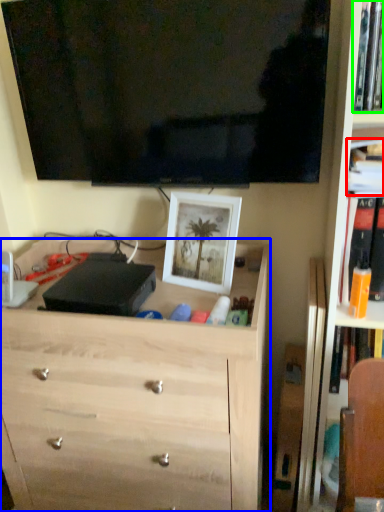
Question: Which is nearer to the book (highlighted by a red box)? chest of drawers (highlighted by a blue box) or book (highlighted by a green box).

Choices:
 (A) chest of drawers
 (B) book

Answer: (B)